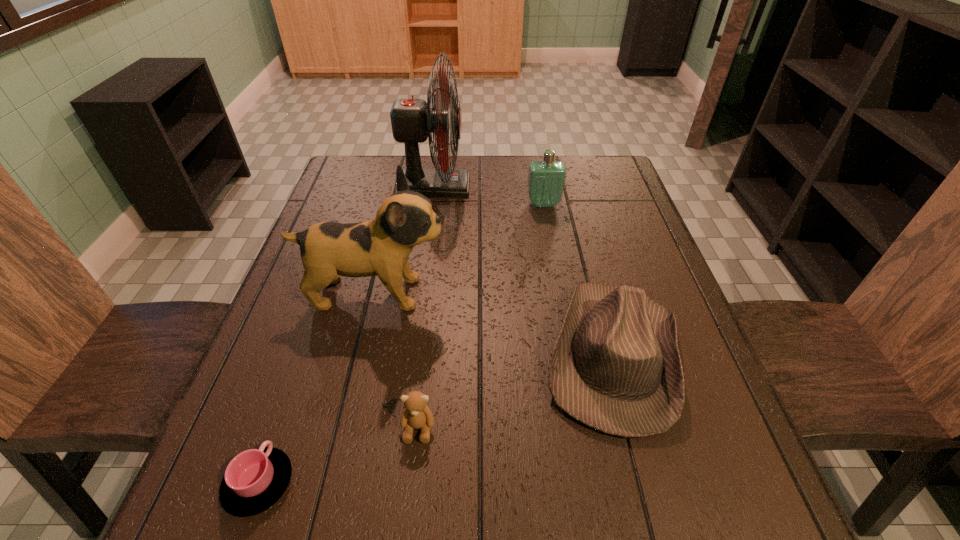
Identify the location of blank space at the far edge of the desktop. The width and height of the screenshot is (960, 540). (508, 168).

Locate an element on the screen. The height and width of the screenshot is (540, 960). vacant space at the near edge of the desktop is located at coordinates (613, 509).

Image resolution: width=960 pixels, height=540 pixels. I want to click on vacant space at the right edge of the desktop, so click(615, 246).

This screenshot has height=540, width=960. In the image, there is a desktop. In order to click on vacant space at the far left corner in this screenshot , I will do `click(347, 168)`.

In order to click on vacant space at the far right corner in this screenshot , I will do `click(603, 156)`.

The height and width of the screenshot is (540, 960). Identify the location of vacant area that lies between the second shortest object and the fedora. (516, 391).

The image size is (960, 540). I want to click on vacant space in between the fedora and the tallest object, so click(524, 271).

The width and height of the screenshot is (960, 540). Identify the location of vacant region between the third shortest object and the third tallest object. (578, 279).

Identify the location of empty space between the fourth tallest object and the second tallest object. (494, 323).

This screenshot has height=540, width=960. I want to click on free spot between the second shortest object and the puppy, so [396, 360].